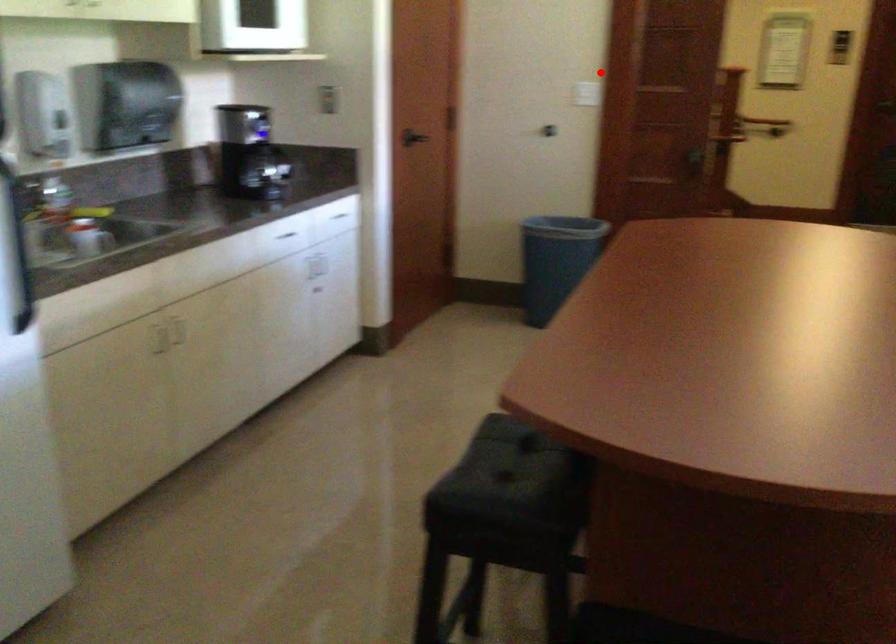
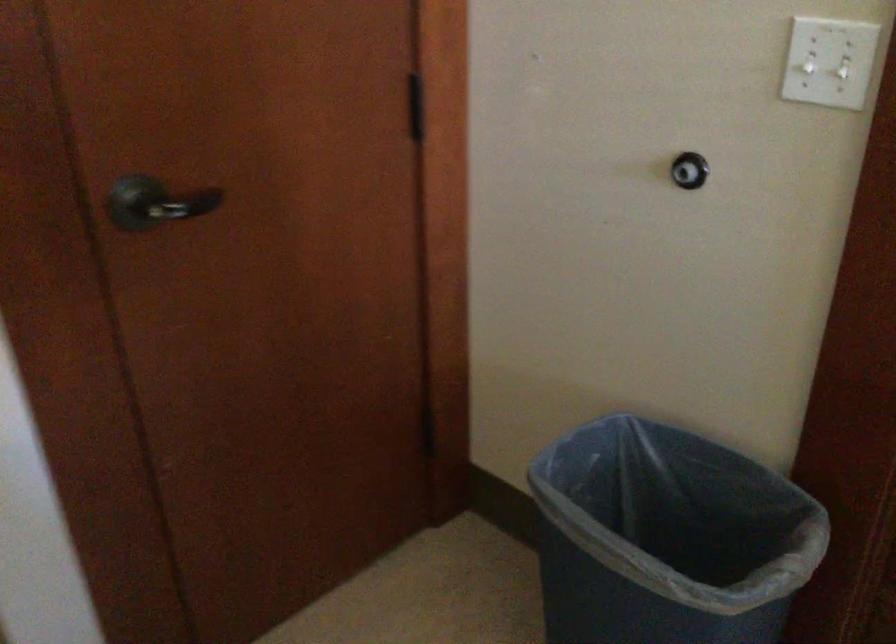
Question: I am providing you with two images of the same scene from different viewpoints. Image1 has a red point marked. In image2, the corresponding 3D location appears at what relative position? Reply with the corresponding letter.

Choices:
 (A) Closer
 (B) Farther

Answer: (A)